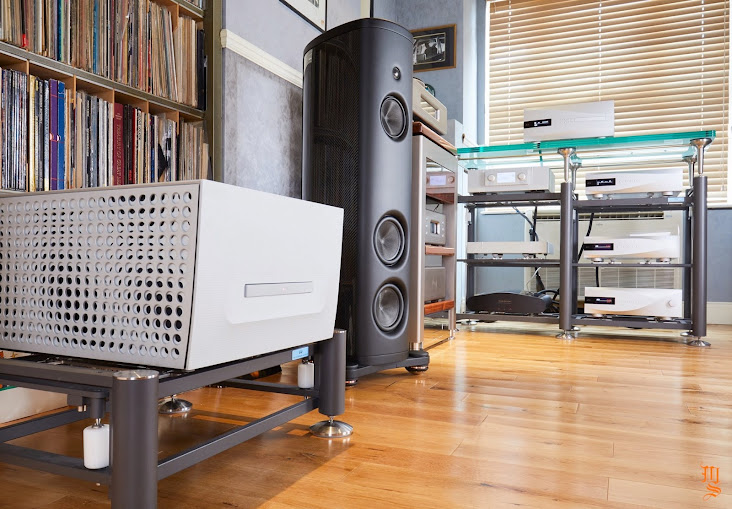
Locate an element on the screen. window is located at coordinates (544, 73).